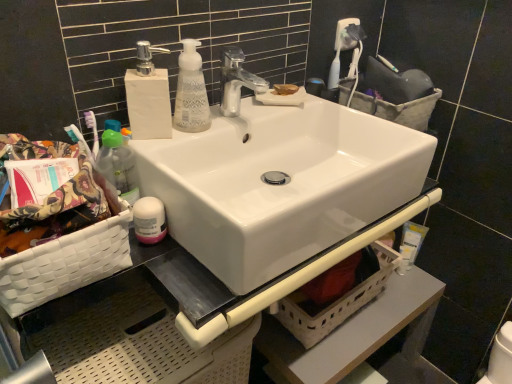
Question: Can you confirm if white glossy sink at center is bigger than translucent plastic bottle at left?

Choices:
 (A) no
 (B) yes

Answer: (B)

Question: From a real-world perspective, does white glossy sink at center sit lower than translucent plastic bottle at left?

Choices:
 (A) no
 (B) yes

Answer: (B)

Question: From a real-world perspective, does white glossy sink at center stand above translucent plastic bottle at left?

Choices:
 (A) yes
 (B) no

Answer: (B)

Question: Considering the relative sizes of white glossy sink at center and translucent plastic bottle at left in the image provided, is white glossy sink at center shorter than translucent plastic bottle at left?

Choices:
 (A) yes
 (B) no

Answer: (A)

Question: Can you confirm if white glossy sink at center is positioned to the right of translucent plastic bottle at left?

Choices:
 (A) no
 (B) yes

Answer: (B)

Question: Can you confirm if white glossy sink at center is taller than translucent plastic bottle at left?

Choices:
 (A) yes
 (B) no

Answer: (B)

Question: Does beige woven basket at lower center, which is the second basket from front to back, have a greater height compared to white plastic lotion at right, the first toiletry in the bottom-to-top sequence?

Choices:
 (A) yes
 (B) no

Answer: (A)

Question: From the image's perspective, is beige woven basket at lower center, marked as the third basket in a top-to-bottom arrangement, above white plastic lotion at right, which appears as the 2th toiletry when viewed from the top?

Choices:
 (A) yes
 (B) no

Answer: (B)

Question: Does beige woven basket at lower center, marked as the 2th basket in a back-to-front arrangement, come behind white plastic lotion at right, which is counted as the 2th toiletry, starting from the front?

Choices:
 (A) no
 (B) yes

Answer: (A)

Question: Is beige woven basket at lower center, marked as the 2th basket in a back-to-front arrangement, far away from white plastic lotion at right, which appears as the 2th toiletry when viewed from the top?

Choices:
 (A) no
 (B) yes

Answer: (A)

Question: Is beige woven basket at lower center, the first basket positioned from the bottom, outside of white plastic lotion at right, the first toiletry in the right-to-left sequence?

Choices:
 (A) yes
 (B) no

Answer: (A)

Question: Is beige woven basket at lower center, marked as the third basket in a top-to-bottom arrangement, bigger than white plastic lotion at right, which appears as the 2th toiletry when viewed from the top?

Choices:
 (A) yes
 (B) no

Answer: (A)

Question: From the image's perspective, does beige woven basket at lower center, marked as the 2th basket in a back-to-front arrangement, appear higher than white matte soap dispenser at upper left?

Choices:
 (A) no
 (B) yes

Answer: (A)